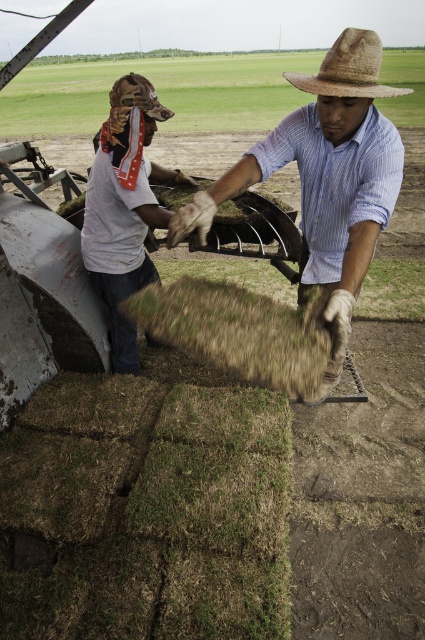
Between white cotton shirt at left and brown straw cowboy hat at upper left, which one appears on the left side from the viewer's perspective?

white cotton shirt at left

Does white cotton shirt at left have a smaller size compared to brown straw cowboy hat at upper left?

Actually, white cotton shirt at left might be larger than brown straw cowboy hat at upper left.

I want to click on white cotton shirt at left, so click(124, 208).

Consider the image. Can you confirm if white cotton shirt at left is positioned to the left of straw hat at upper center?

Correct, you'll find white cotton shirt at left to the left of straw hat at upper center.

You are a GUI agent. You are given a task and a screenshot of the screen. Output one action in this format:
    pyautogui.click(x=<x>, y=<y>)
    Task: Click on the white cotton shirt at left
    Image resolution: width=425 pixels, height=640 pixels.
    Given the screenshot: What is the action you would take?
    pyautogui.click(x=124, y=208)

Does point (333, 177) come farther from viewer compared to point (342, 93)?

Yes, it is.

Does brown straw hat at center appear on the right side of straw hat at upper center?

No, brown straw hat at center is not to the right of straw hat at upper center.

The image size is (425, 640). Find the location of `brown straw hat at center`. brown straw hat at center is located at coordinates (325, 179).

Find the location of a particular element. The image size is (425, 640). brown straw hat at center is located at coordinates (325, 179).